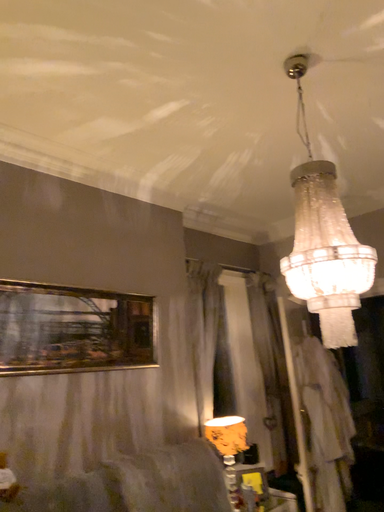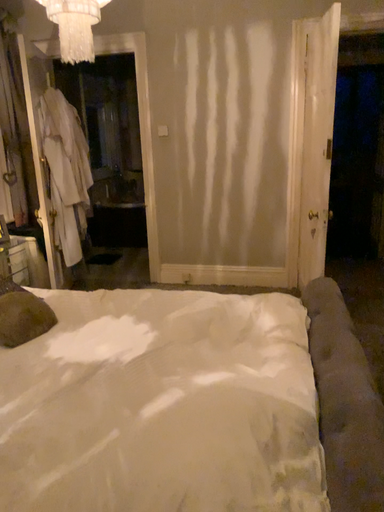
Question: How did the camera likely rotate when shooting the video?

Choices:
 (A) rotated left
 (B) rotated right

Answer: (B)